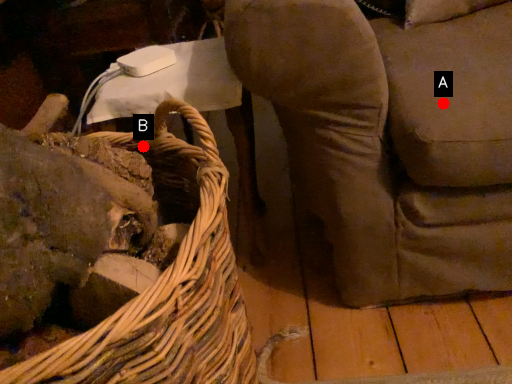
Question: Two points are circled on the image, labeled by A and B beside each circle. Which point is closer to the camera?

Choices:
 (A) A is closer
 (B) B is closer

Answer: (A)